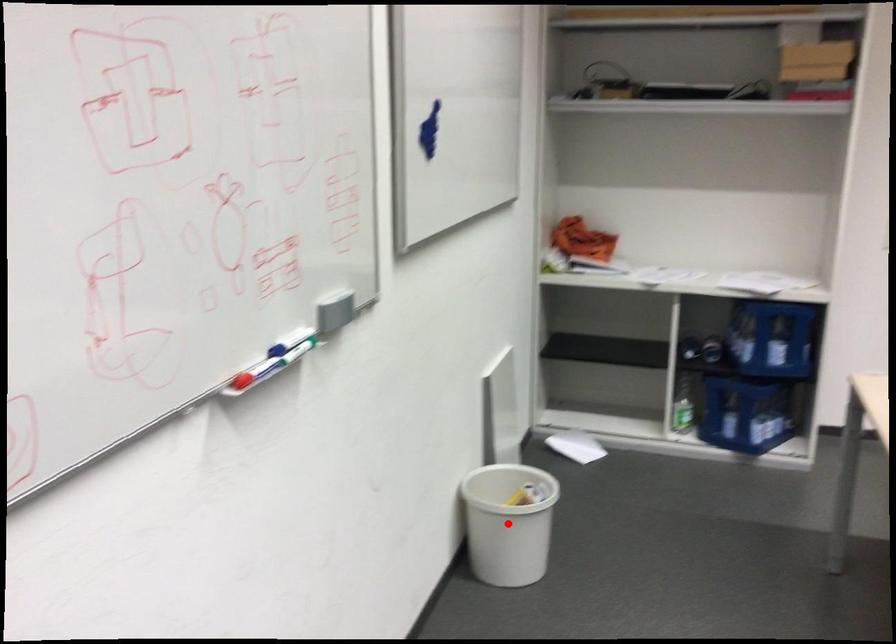
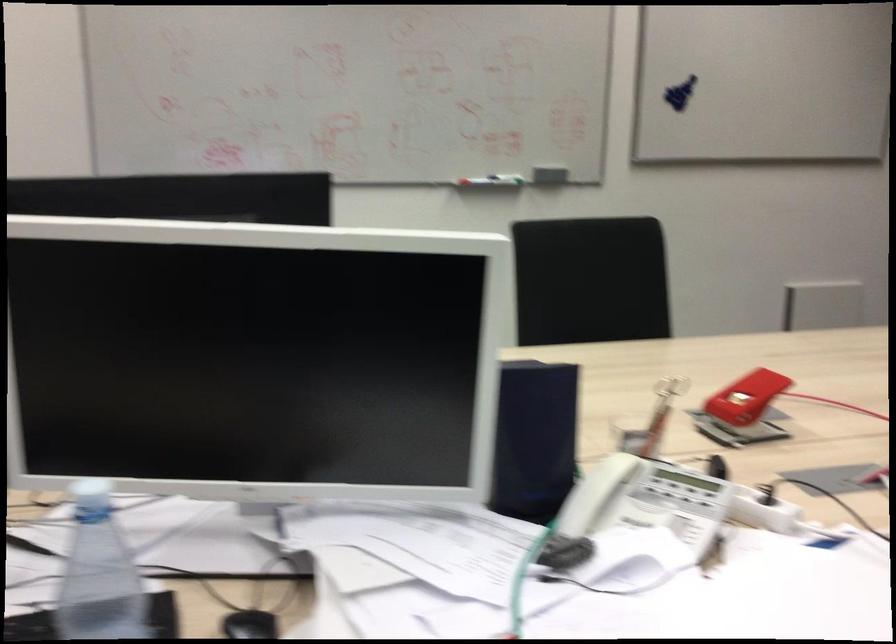
Question: I am providing you with two images of the same scene from different viewpoints. A red point is marked on the first image. At the location where the point appears in image 1, is it still visible in image 2?

Choices:
 (A) Yes
 (B) No

Answer: (B)